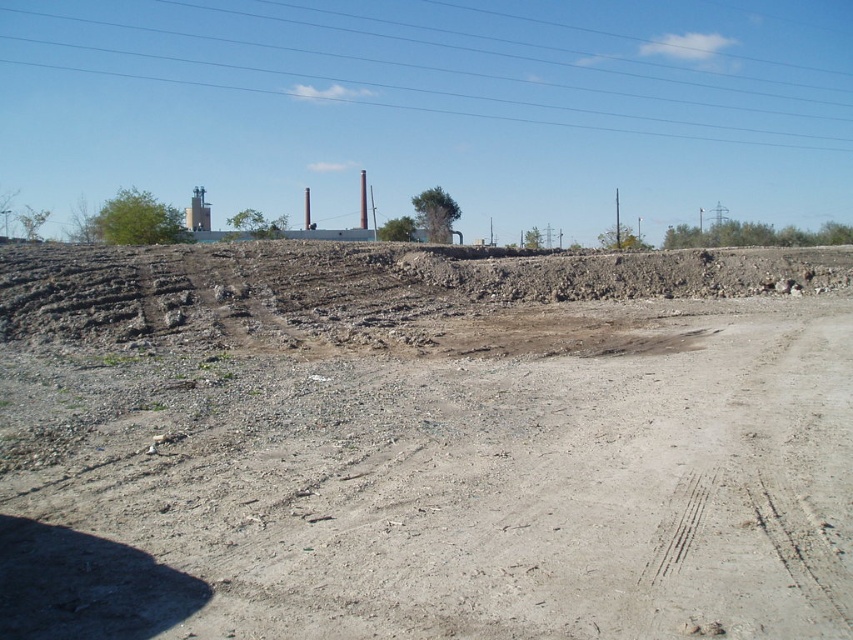
You are standing in the industrial area and looking up. Which object is lower in the scene, the dull gray gravel at center or the clear blue sky at upper center?

The dull gray gravel at center is lower than the clear blue sky at upper center because the sky is positioned higher up in the scene.

You are standing at the point with coordinates 0.5, 0.5 in the image. You want to walk to the dull gray gravel at center. Which direction should you move to reach it?

The dull gray gravel at center is located at point (424, 444). Since you are at (426, 320), you should move northeast to reach it.

You are standing in the industrial area and looking up. Which object is higher from the ground, the dull gray gravel at center or the clear blue sky at upper center?

The clear blue sky at upper center is higher from the ground than the dull gray gravel at center.